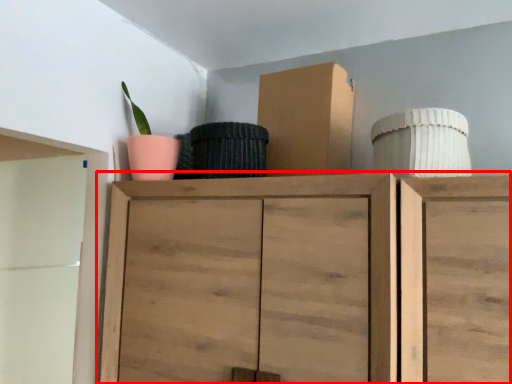
Question: From the image, what is the correct spatial relationship of cupboard (annotated by the red box) in relation to cardboard box?

Choices:
 (A) left
 (B) right

Answer: (A)